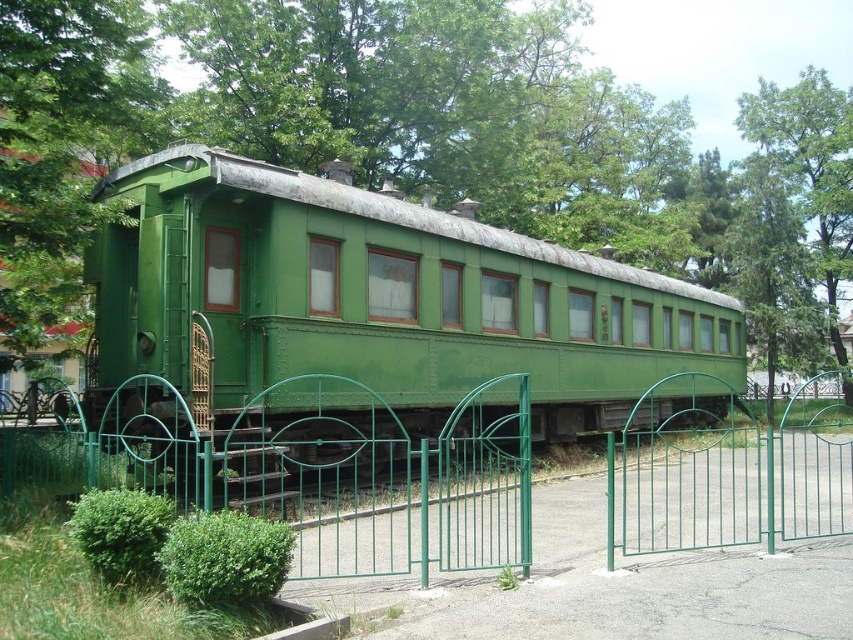
Question: Which object appears farthest from the camera in this image?

Choices:
 (A) green metal gate at center
 (B) green leafy tree at upper right
 (C) green matte train car at center

Answer: (B)

Question: Does green metal gate at center appear over green leafy tree at upper right?

Choices:
 (A) no
 (B) yes

Answer: (A)

Question: Can you confirm if green matte train car at center is thinner than green metal gate at center?

Choices:
 (A) no
 (B) yes

Answer: (B)

Question: From the image, what is the correct spatial relationship of green metal gate at center in relation to green leafy tree at upper right?

Choices:
 (A) below
 (B) above

Answer: (A)

Question: Which object appears closest to the camera in this image?

Choices:
 (A) green matte train car at center
 (B) green leafy tree at upper right

Answer: (A)

Question: Which of the following is the farthest from the observer?

Choices:
 (A) (317, 276)
 (B) (843, 136)
 (C) (817, 144)

Answer: (C)